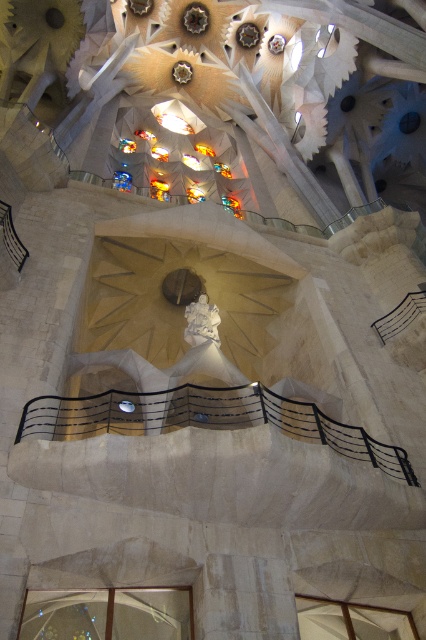
Question: Among these objects, which one is nearest to the camera?

Choices:
 (A) transparent glass window at lower left
 (B) transparent glass window at lower right
 (C) white marble statue at center

Answer: (A)

Question: Is transparent glass window at lower right below white marble statue at center?

Choices:
 (A) yes
 (B) no

Answer: (A)

Question: Among these objects, which one is farthest from the camera?

Choices:
 (A) white marble statue at center
 (B) transparent glass window at lower left
 (C) transparent glass window at lower right

Answer: (A)

Question: Which object is farther from the camera taking this photo?

Choices:
 (A) transparent glass window at lower left
 (B) white marble statue at center
 (C) transparent glass window at lower right

Answer: (B)

Question: Is black metal railing at center to the right of transparent glass window at lower right from the viewer's perspective?

Choices:
 (A) no
 (B) yes

Answer: (A)

Question: Is transparent glass window at lower left below transparent glass window at lower right?

Choices:
 (A) yes
 (B) no

Answer: (A)